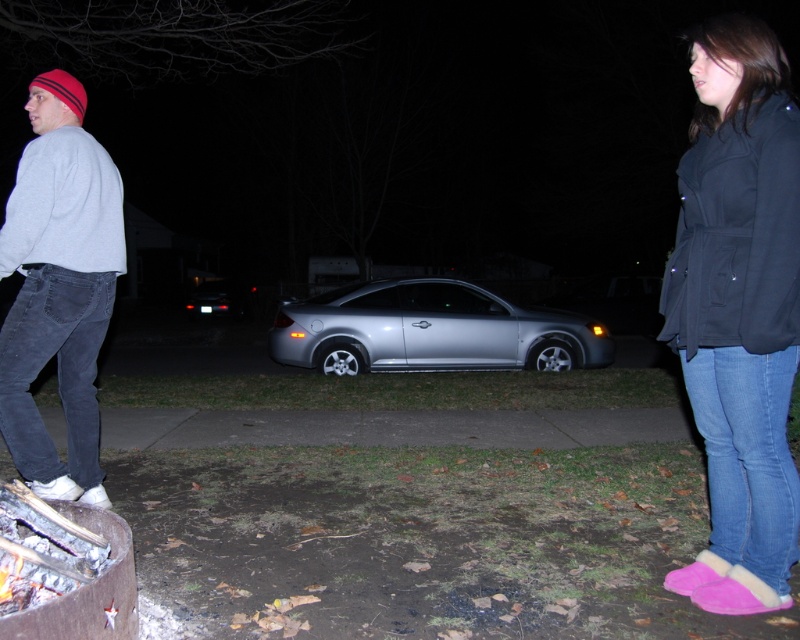
Question: Does dark blue fleece jacket at right have a larger size compared to silver metallic car at center?

Choices:
 (A) no
 (B) yes

Answer: (A)

Question: Which point appears closest to the camera in this image?

Choices:
 (A) (778, 296)
 (B) (81, 272)
 (C) (742, 561)

Answer: (A)

Question: Can you confirm if dark blue fleece jacket at right is wider than silver metallic car at center?

Choices:
 (A) no
 (B) yes

Answer: (A)

Question: Which is farther from the gray cotton sweatshirt at left?

Choices:
 (A) silver metallic car at center
 (B) black matte jacket at right

Answer: (A)

Question: Among these objects, which one is farthest from the camera?

Choices:
 (A) black matte jacket at right
 (B) gray cotton sweatshirt at left

Answer: (B)

Question: Can you confirm if black matte jacket at right is positioned to the right of silver metallic car at center?

Choices:
 (A) no
 (B) yes

Answer: (B)